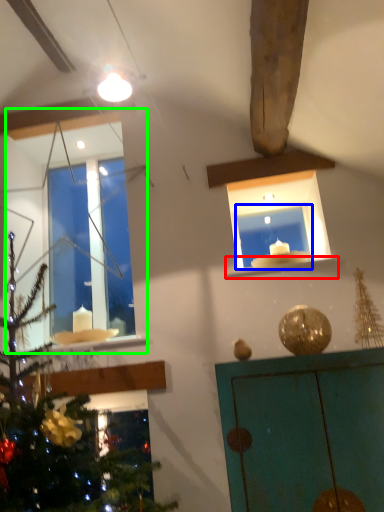
Question: Which is nearer to the window sill (highlighted by a red box)? window frame (highlighted by a blue box) or window (highlighted by a green box).

Choices:
 (A) window frame
 (B) window

Answer: (A)